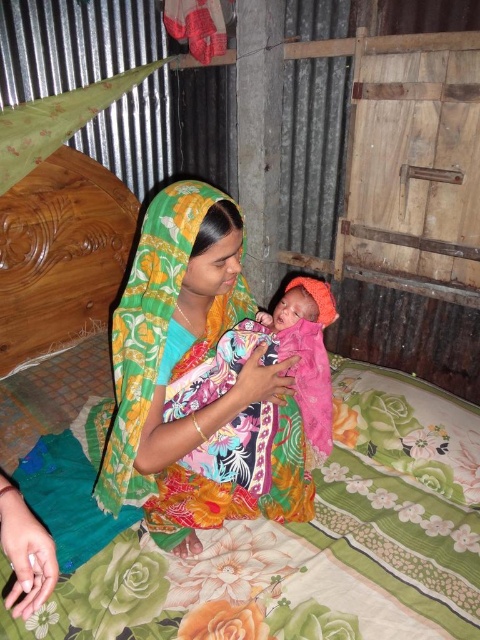
Is floral fabric cloth at center to the right of orange fabric swaddle at center from the viewer's perspective?

No, floral fabric cloth at center is not to the right of orange fabric swaddle at center.

Can you confirm if floral fabric cloth at center is thinner than orange fabric swaddle at center?

In fact, floral fabric cloth at center might be wider than orange fabric swaddle at center.

Which is in front, point (208, 499) or point (299, 307)?

Point (299, 307)

At what (x,y) coordinates should I click in order to perform the action: click on floral fabric cloth at center. Please return your answer as a coordinate pair (x, y). Image resolution: width=480 pixels, height=640 pixels. Looking at the image, I should click on (187, 371).

Consider the image. Can you confirm if floral fabric quilt at center is wider than floral fabric cloth at center?

Indeed, floral fabric quilt at center has a greater width compared to floral fabric cloth at center.

Where is `floral fabric quilt at center`? This screenshot has width=480, height=640. floral fabric quilt at center is located at coordinates [x=312, y=541].

Is floral fabric quilt at center thinner than orange fabric swaddle at center?

No, floral fabric quilt at center is not thinner than orange fabric swaddle at center.

Can you confirm if floral fabric quilt at center is positioned to the right of orange fabric swaddle at center?

Yes, floral fabric quilt at center is to the right of orange fabric swaddle at center.

The image size is (480, 640). What do you see at coordinates (312, 541) in the screenshot?
I see `floral fabric quilt at center` at bounding box center [312, 541].

Find the location of a particular element. This screenshot has height=640, width=480. floral fabric quilt at center is located at coordinates (312, 541).